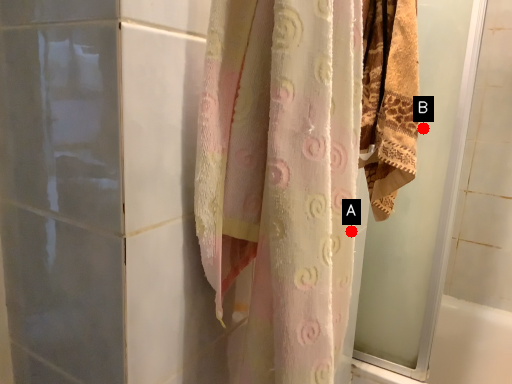
Question: Two points are circled on the image, labeled by A and B beside each circle. Which point is further to the camera?

Choices:
 (A) A is further
 (B) B is further

Answer: (B)